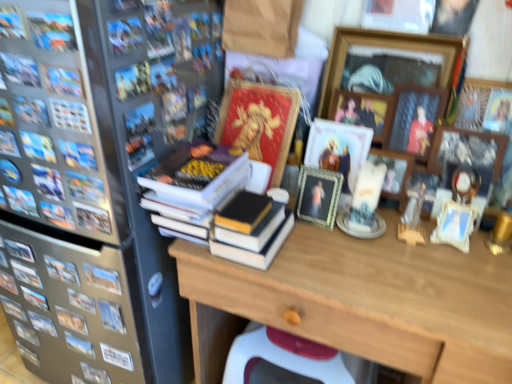
Question: Does wooden desk at center come in front of hardcover book at left, the second book when ordered from left to right?

Choices:
 (A) yes
 (B) no

Answer: (A)

Question: Is wooden desk at center aimed at hardcover book at left, the second book when ordered from left to right?

Choices:
 (A) no
 (B) yes

Answer: (A)

Question: Can you confirm if wooden desk at center is bigger than hardcover book at left, which is the 3th book in right-to-left order?

Choices:
 (A) no
 (B) yes

Answer: (B)

Question: Is wooden desk at center wider than hardcover book at left, the second book when ordered from left to right?

Choices:
 (A) yes
 (B) no

Answer: (A)

Question: Is wooden desk at center positioned beyond the bounds of hardcover book at left, which is the 3th book in right-to-left order?

Choices:
 (A) no
 (B) yes

Answer: (B)

Question: From the image's perspective, is wooden desk at center beneath hardcover book at left, which appears as the second book when ordered from the bottom?

Choices:
 (A) yes
 (B) no

Answer: (A)

Question: From a real-world perspective, is wooden picture frame at upper right, the third picture frame from the left, positioned over hardcover books at center, positioned as the 2th book in top-to-bottom order, based on gravity?

Choices:
 (A) yes
 (B) no

Answer: (A)

Question: Is wooden picture frame at upper right, marked as the third picture frame in a right-to-left arrangement, beside hardcover books at center, positioned as the 2th book in top-to-bottom order?

Choices:
 (A) no
 (B) yes

Answer: (A)

Question: Could you tell me if wooden picture frame at upper right, the third picture frame from the left, is turned towards hardcover books at center, the 3th book positioned from the bottom?

Choices:
 (A) no
 (B) yes

Answer: (B)

Question: Can you confirm if wooden picture frame at upper right, the third picture frame from the left, is thinner than hardcover books at center, the 3th book positioned from the bottom?

Choices:
 (A) no
 (B) yes

Answer: (B)

Question: Does wooden picture frame at upper right, marked as the third picture frame in a right-to-left arrangement, have a lesser height compared to hardcover books at center, the 3th book positioned from the bottom?

Choices:
 (A) no
 (B) yes

Answer: (A)

Question: Is wooden picture frame at upper right, marked as the third picture frame in a right-to-left arrangement, wider than hardcover books at center, which is counted as the fourth book, starting from the left?

Choices:
 (A) no
 (B) yes

Answer: (A)

Question: Is wooden desk at center at the left side of wooden picture frame at upper right, which is the 2th picture frame from right to left?

Choices:
 (A) yes
 (B) no

Answer: (A)